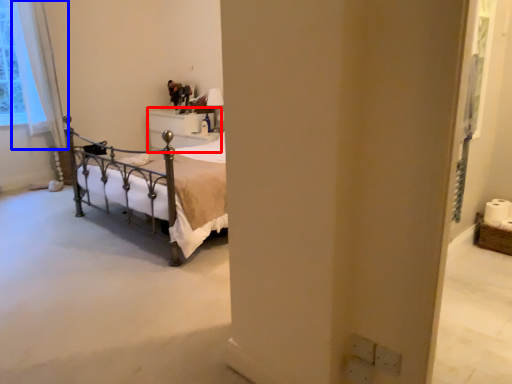
Question: Which of the following is the closest to the observer, furniture (highlighted by a red box) or curtain (highlighted by a blue box)?

Choices:
 (A) furniture
 (B) curtain

Answer: (B)